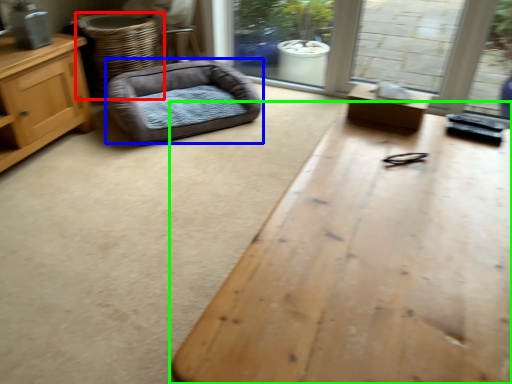
Question: Which object is positioned closest to basket (highlighted by a red box)? Select from dog bed (highlighted by a blue box) and table (highlighted by a green box).

Choices:
 (A) dog bed
 (B) table

Answer: (A)